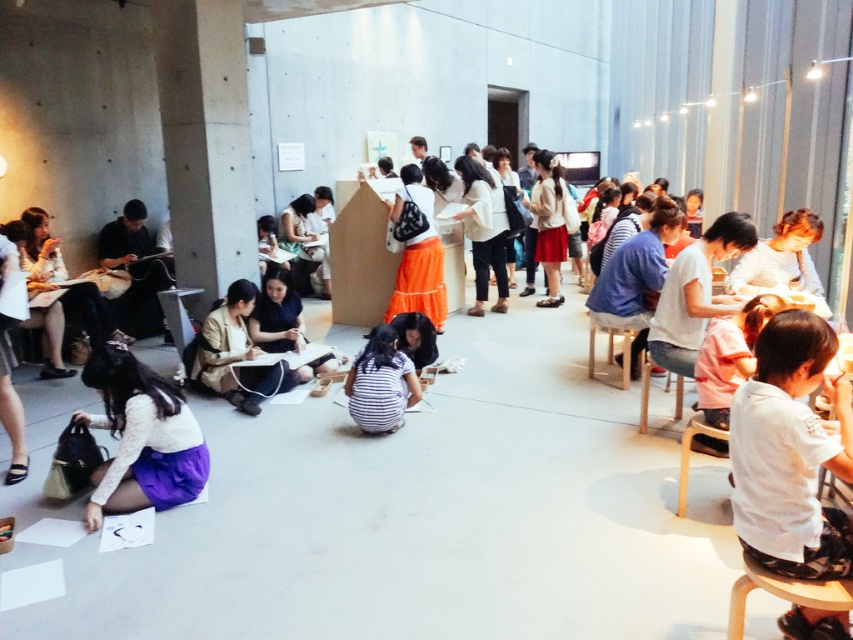
Question: Is striped fabric at center below wooden chair at center?

Choices:
 (A) no
 (B) yes

Answer: (B)

Question: Which is nearer to the matte beige jacket at center?

Choices:
 (A) wooden chair at center
 (B) striped fabric at center
 (C) light wood chair at lower right
 (D) purple lace skirt at lower left

Answer: (B)

Question: Which point appears closest to the camera in this image?

Choices:
 (A) (689, 433)
 (B) (614, 314)
 (C) (241, 285)
 (D) (379, 380)

Answer: (A)

Question: Does striped fabric at center have a larger size compared to wooden chair at center?

Choices:
 (A) yes
 (B) no

Answer: (B)

Question: Can you confirm if purple lace skirt at lower left is positioned above wooden chair at center?

Choices:
 (A) yes
 (B) no

Answer: (B)

Question: Which point is closer to the camera?

Choices:
 (A) (712, 433)
 (B) (648, 317)
 (C) (247, 333)

Answer: (A)